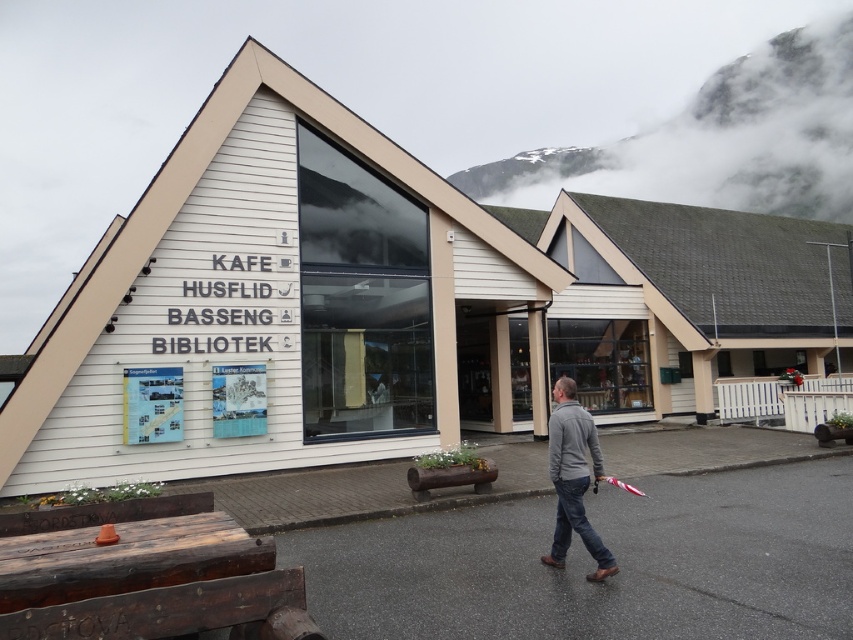
You are standing at the point marked by the coordinates point (387, 305). Looking around, which building feature would you see directly in front of you?

The white wood building at center is represented by point (387, 305), so standing at that point, you would be at the building itself and thus would not see it directly in front of you. Instead, you would see the surrounding environment like the mountainous landscape reflected in the large glass windows.

You are standing in front of the modern building with triangular roof. You see two points marked on the ground in front of you. The first point is at coordinate point (416, 628) and the second point is at coordinate point (563, 525). Which point is closer to you?

Point (416, 628) is closer to you than point (563, 525).